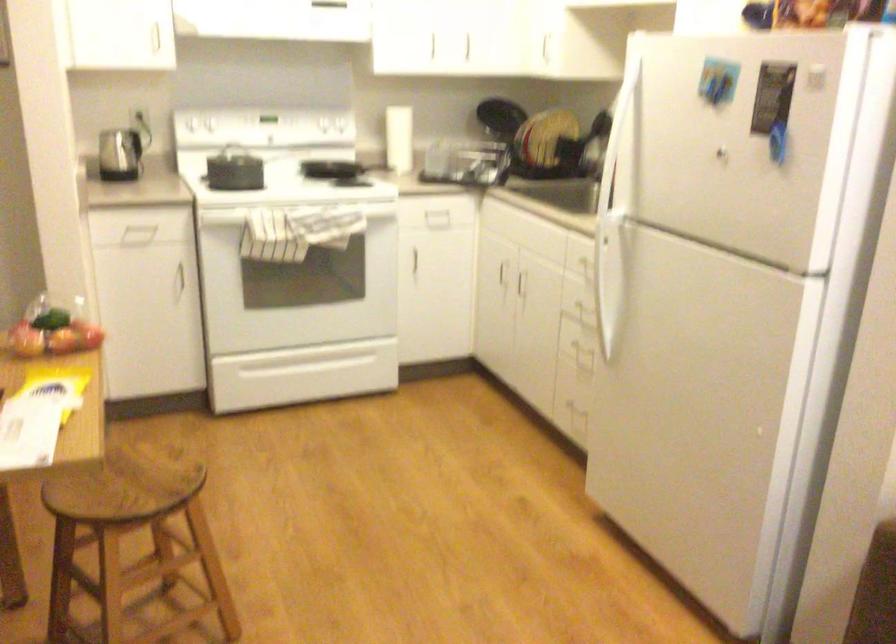
This screenshot has height=644, width=896. In order to click on kettle handle in this screenshot , I will do `click(149, 131)`.